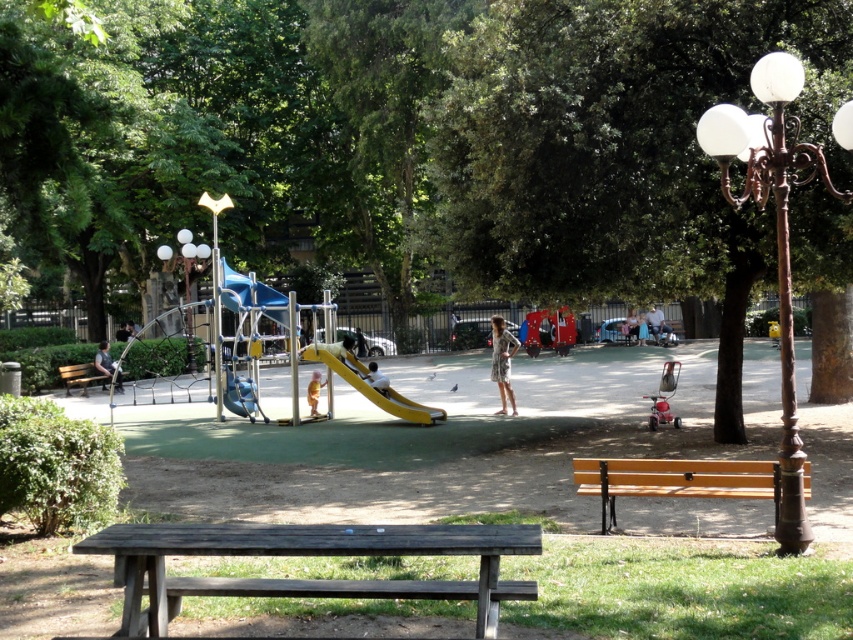
Can you confirm if bronze wrought iron streetlight at right is bigger than yellow matte slide at center?

Indeed, bronze wrought iron streetlight at right has a larger size compared to yellow matte slide at center.

Does point (780, 480) come farther from viewer compared to point (415, 417)?

No, (780, 480) is closer to viewer.

Locate an element on the screen. bronze wrought iron streetlight at right is located at coordinates (776, 237).

Is matte gray dress at center smaller than light blue denim dress at center?

No.

Does matte gray dress at center have a larger size compared to light blue denim dress at center?

Correct, matte gray dress at center is larger in size than light blue denim dress at center.

Between point (502, 388) and point (642, 312), which one is positioned in front?

Positioned in front is point (502, 388).

At what (x,y) coordinates should I click in order to perform the action: click on matte gray dress at center. Please return your answer as a coordinate pair (x, y). This screenshot has height=640, width=853. Looking at the image, I should click on (502, 362).

Does dark gray fabric jacket at left have a lesser height compared to light blue denim jeans at center?

Correct, dark gray fabric jacket at left is not as tall as light blue denim jeans at center.

Does dark gray fabric jacket at left have a smaller size compared to light blue denim jeans at center?

Yes, dark gray fabric jacket at left is smaller than light blue denim jeans at center.

In the scene shown: Who is more distant from viewer, [108,353] or [637,324]?

Point [637,324]

You are a GUI agent. You are given a task and a screenshot of the screen. Output one action in this format:
    pyautogui.click(x=<x>, y=<y>)
    Task: Click on the dark gray fabric jacket at left
    
    Given the screenshot: What is the action you would take?
    pyautogui.click(x=103, y=358)